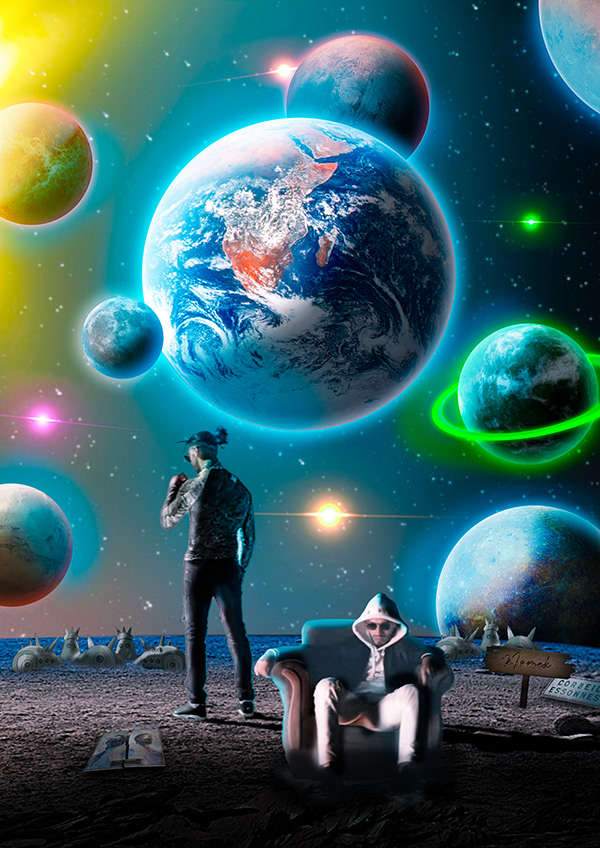
Find the location of a particular element. Image resolution: width=600 pixels, height=848 pixels. pink light is located at coordinates (31, 420).